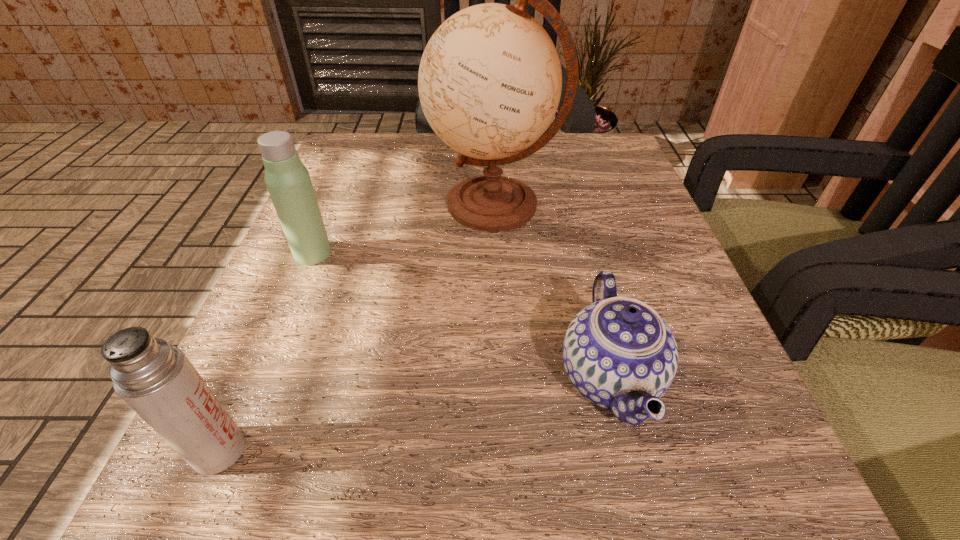
This screenshot has width=960, height=540. In order to click on free spot located 0.360m at the spout of the shortest object in this screenshot , I will do `click(272, 379)`.

Locate an element on the screen. This screenshot has width=960, height=540. free region located 0.050m at the spout of the shortest object is located at coordinates (519, 379).

Locate an element on the screen. free space located at the spout of the shortest object is located at coordinates [351, 379].

The width and height of the screenshot is (960, 540). In order to click on object positioned at the far edge in this screenshot , I will do `click(490, 80)`.

Identify the location of thermos bottle situated at the near edge. (156, 379).

This screenshot has height=540, width=960. Find the location of `chinaware at the near edge`. chinaware at the near edge is located at coordinates (618, 353).

Locate an element on the screen. The image size is (960, 540). object at the right edge is located at coordinates point(618,353).

Where is `object positioned at the near left corner`? Image resolution: width=960 pixels, height=540 pixels. object positioned at the near left corner is located at coordinates (156, 379).

The width and height of the screenshot is (960, 540). What are the coordinates of `object positioned at the near right corner` in the screenshot? It's located at (618, 353).

The width and height of the screenshot is (960, 540). I want to click on blank space at the far edge of the desktop, so click(540, 172).